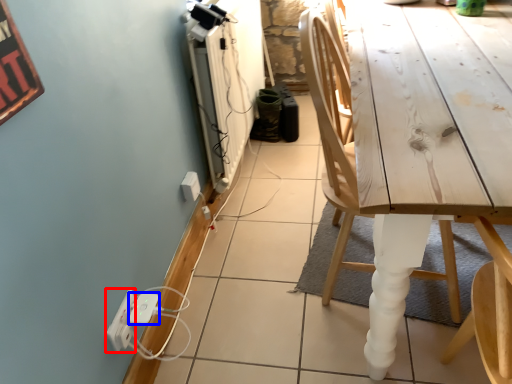
Question: Among these objects, which one is farthest to the camera, electric outlet (highlighted by a red box) or extension cord (highlighted by a blue box)?

Choices:
 (A) electric outlet
 (B) extension cord

Answer: (B)